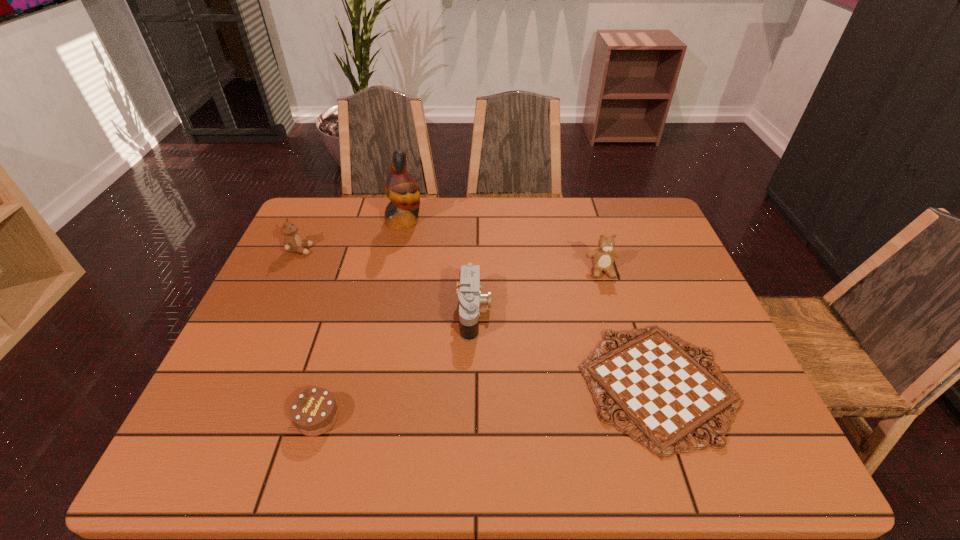
Image resolution: width=960 pixels, height=540 pixels. Identify the location of vacant region located on the face of the farthest object. (492, 221).

Locate an element on the screen. free point located on the front-facing side of the fourth nearest object is located at coordinates (625, 348).

Where is `free space located 0.310m on the front-facing side of the left teddy bear`? This screenshot has height=540, width=960. free space located 0.310m on the front-facing side of the left teddy bear is located at coordinates (418, 250).

The image size is (960, 540). I want to click on free location located on the lens of the camera, so click(x=574, y=312).

Where is `vacant space located 0.110m on the right of the chocolate cake`? The width and height of the screenshot is (960, 540). vacant space located 0.110m on the right of the chocolate cake is located at coordinates (393, 417).

Identify the location of vacant area located on the back of the shortest object. (616, 262).

Where is `parrot that is at the far edge`? The height and width of the screenshot is (540, 960). parrot that is at the far edge is located at coordinates (403, 191).

The height and width of the screenshot is (540, 960). I want to click on teddy bear positioned at the far edge, so pyautogui.click(x=292, y=242).

Where is `chocolate cake at the near edge`? The width and height of the screenshot is (960, 540). chocolate cake at the near edge is located at coordinates (314, 412).

Identify the location of chessboard at the near edge. (667, 395).